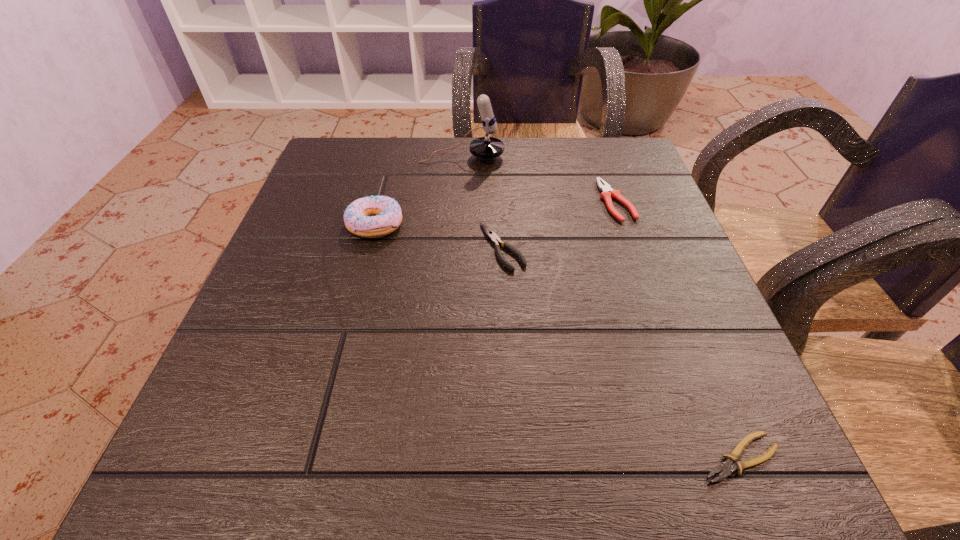
Locate an element on the screen. The image size is (960, 540). vacant space at the near edge of the desktop is located at coordinates (644, 433).

The width and height of the screenshot is (960, 540). I want to click on blank area at the left edge, so tap(244, 424).

Identify the location of vacant space at the right edge of the desktop. The width and height of the screenshot is (960, 540). (682, 359).

Find the location of a particular element. vacant area at the far left corner of the desktop is located at coordinates (373, 176).

The width and height of the screenshot is (960, 540). Identify the location of vacant region at the near left corner of the desktop. (282, 469).

This screenshot has width=960, height=540. What are the coordinates of `vacant region at the far right corner` in the screenshot? It's located at (609, 168).

In the image, there is a desktop. Where is `vacant region at the near right corner`? The width and height of the screenshot is (960, 540). vacant region at the near right corner is located at coordinates (788, 467).

Image resolution: width=960 pixels, height=540 pixels. I want to click on vacant point located between the nearest pliers and the doughnut, so click(558, 341).

Locate an element on the screen. The image size is (960, 540). free spot between the tallest object and the farthest pliers is located at coordinates (539, 179).

At what (x,y) coordinates should I click in order to perform the action: click on vacant space that's between the doughnut and the nearest pliers. Please return your answer as a coordinate pair (x, y). This screenshot has height=540, width=960. Looking at the image, I should click on (558, 341).